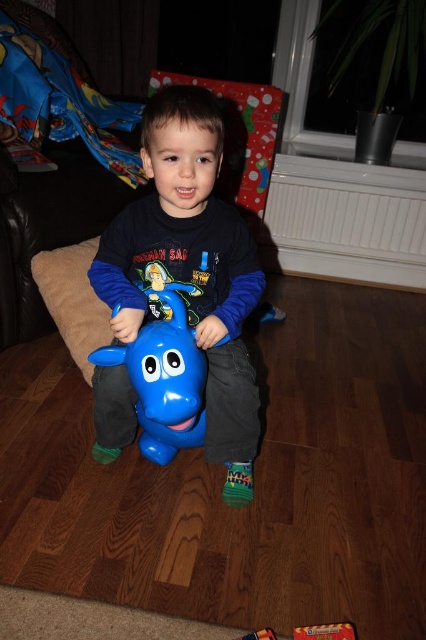
Question: Does matte plastic toy horse at center appear on the left side of blue rubber horse at center?

Choices:
 (A) no
 (B) yes

Answer: (A)

Question: Is matte plastic toy horse at center wider than blue rubber horse at center?

Choices:
 (A) yes
 (B) no

Answer: (A)

Question: Observing the image, what is the correct spatial positioning of matte plastic toy horse at center in reference to blue rubber horse at center?

Choices:
 (A) left
 (B) right

Answer: (B)

Question: Among these objects, which one is nearest to the camera?

Choices:
 (A) blue rubber horse at center
 (B) matte plastic toy horse at center

Answer: (A)